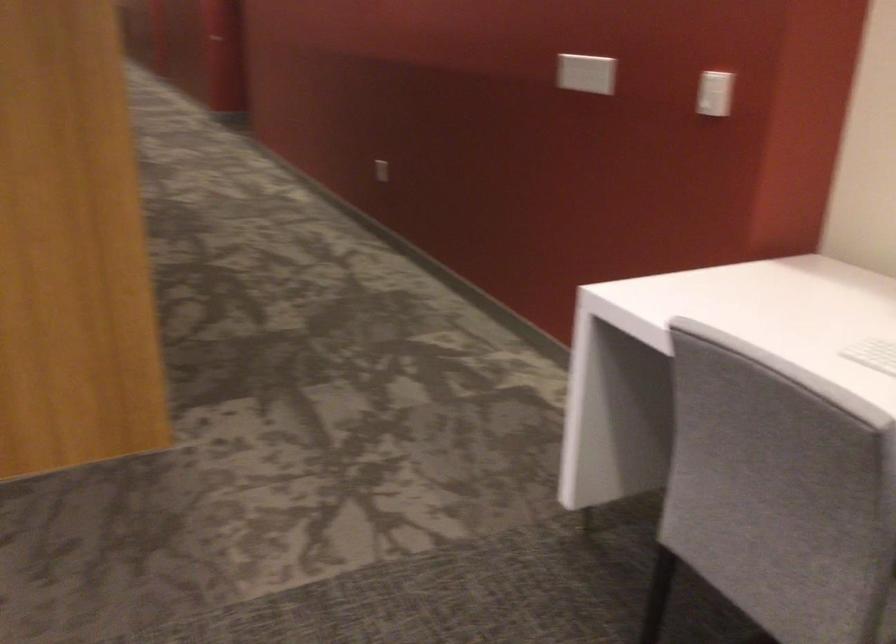
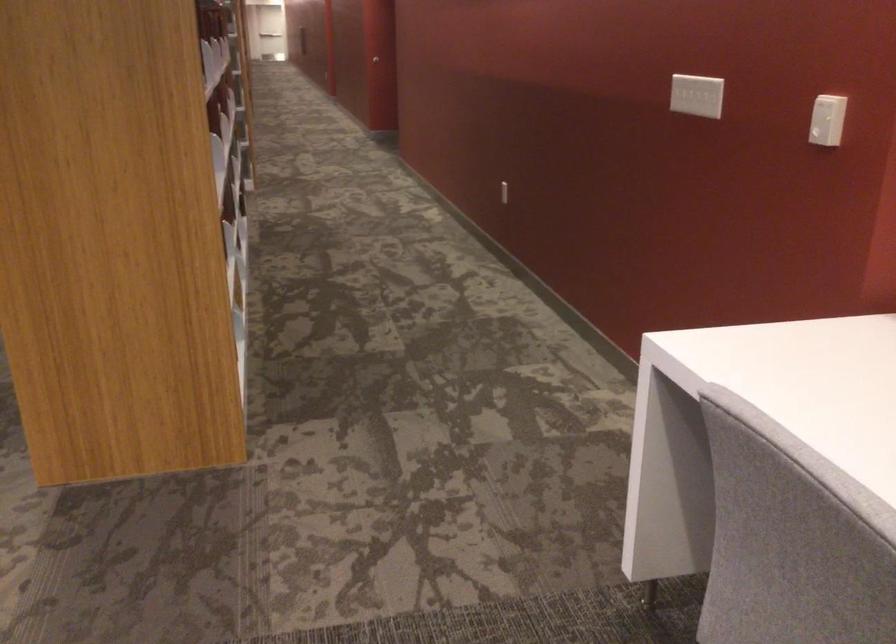
The images are taken continuously from a first-person perspective. In which direction are you moving?

The movement direction of the cameraman is right, forward.